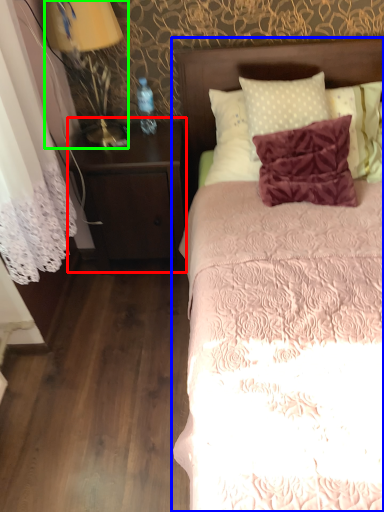
Question: Which object is the closest to the nightstand (highlighted by a red box)? Choose among these: bed (highlighted by a blue box) or bedside lamp (highlighted by a green box).

Choices:
 (A) bed
 (B) bedside lamp

Answer: (B)